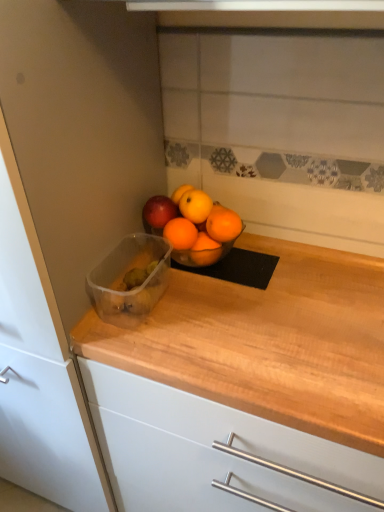
Describe the element at coordinates (195, 206) in the screenshot. The width and height of the screenshot is (384, 512). I see `orange matte/orange at center` at that location.

Locate an element on the screen. This screenshot has width=384, height=512. wooden countertop at left is located at coordinates (73, 201).

At what (x,y) coordinates should I click in order to perform the action: click on transparent plastic container at center. Please return your answer as a coordinate pair (x, y). Looking at the image, I should click on (123, 279).

What are the coordinates of `glass bowl lying in front of the orange matte/orange at center` in the screenshot? It's located at 123,279.

Is transparent plastic container at center facing towards orange matte/orange at center?

No, transparent plastic container at center is not turned towards orange matte/orange at center.

From the image's perspective, is transparent plastic container at center located above orange matte/orange at center?

Incorrect, from the image's perspective, transparent plastic container at center is lower than orange matte/orange at center.

Between transparent plastic container at center and orange matte/orange at center, which one has larger width?

Wider between the two is transparent plastic container at center.

From a real-world perspective, who is located higher, wooden countertop at left or transparent plastic container at center?

transparent plastic container at center, from a real-world perspective.

This screenshot has height=512, width=384. What are the coordinates of `glass bowl above the wooden countertop at left (from the image's perspective)` in the screenshot? It's located at pos(123,279).

Considering the points (118, 95) and (139, 257), which point is in front, point (118, 95) or point (139, 257)?

The point (118, 95) is in front.

Do you think wooden countertop at left is within transparent plastic container at center, or outside of it?

The correct answer is: outside.

Choose the correct answer: Is transparent plastic container at center inside wooden countertop at left or outside it?

transparent plastic container at center is not enclosed by wooden countertop at left.

Based on their positions, is transparent plastic container at center located to the left or right of wooden countertop at left?

Clearly, transparent plastic container at center is on the right of wooden countertop at left in the image.

Considering the positions of objects transparent plastic container at center and wooden countertop at left in the image provided, who is behind, transparent plastic container at center or wooden countertop at left?

transparent plastic container at center is further from the camera.

Is point (161, 252) positioned behind point (107, 117)?

Yes, point (161, 252) is behind point (107, 117).

Looking at the image, does orange matte/orange at center seem bigger or smaller compared to wooden at center?

orange matte/orange at center is smaller than wooden at center.

Identify the location of countertop that is on the right side of orange matte/orange at center. The image size is (384, 512). (245, 387).

Can you confirm if orange matte/orange at center is wider than wooden at center?

Incorrect, the width of orange matte/orange at center does not surpass that of wooden at center.

Does point (202, 203) appear closer or farther from the camera than point (254, 434)?

Clearly, point (202, 203) is more distant from the camera than point (254, 434).

Is wooden countertop at left facing towards orange matte/orange at center?

No, wooden countertop at left is not oriented towards orange matte/orange at center.

From a real-world perspective, who is located higher, wooden countertop at left or orange matte/orange at center?

orange matte/orange at center.

Based on their sizes in the image, would you say wooden countertop at left is bigger or smaller than orange matte/orange at center?

wooden countertop at left is bigger than orange matte/orange at center.

Which is in front, point (128, 146) or point (201, 208)?

Positioned in front is point (128, 146).

Does transparent plastic container at center have a smaller size compared to wooden at center?

Correct, transparent plastic container at center occupies less space than wooden at center.

Based on the photo, between transparent plastic container at center and wooden at center, which one is positioned behind?

transparent plastic container at center is behind.

At what (x,y) coordinates should I click in order to perform the action: click on glass bowl on the left of wooden at center. Please return your answer as a coordinate pair (x, y). Image resolution: width=384 pixels, height=512 pixels. Looking at the image, I should click on (123, 279).

Based on the photo, considering the relative sizes of transparent plastic container at center and wooden at center in the image provided, is transparent plastic container at center thinner than wooden at center?

Yes, transparent plastic container at center is thinner than wooden at center.

Based on the photo, considering the sizes of objects wooden at center and wooden countertop at left in the image provided, who is wider, wooden at center or wooden countertop at left?

With larger width is wooden countertop at left.

From a real-world perspective, is wooden at center positioned above or below wooden countertop at left?

wooden at center is below wooden countertop at left.

From the picture: Which is closer, (184, 497) or (115, 65)?

Point (184, 497).

From the picture: How different are the orientations of wooden at center and wooden countertop at left in degrees?

They differ by 0.104 degrees in their facing directions.

This screenshot has height=512, width=384. In order to click on orange behind the transparent plastic container at center in this screenshot , I will do `click(195, 206)`.

Find the location of a particular element. This screenshot has height=512, width=384. glass bowl above the wooden countertop at left (from a real-world perspective) is located at coordinates (123, 279).

Estimate the real-world distances between objects in this image. Which object is further from orange matte/orange at center, wooden countertop at left or wooden at center?

wooden at center is positioned further to the anchor orange matte/orange at center.

Considering their positions, is transparent plastic container at center positioned further to wooden countertop at left than wooden at center?

The object further to wooden countertop at left is wooden at center.

Looking at the image, which one is located closer to transparent plastic container at center, wooden at center or orange matte/orange at center?

Among the two, orange matte/orange at center is located nearer to transparent plastic container at center.

Consider the image. Looking at the image, which one is located closer to transparent plastic container at center, wooden at center or wooden countertop at left?

wooden countertop at left lies closer to transparent plastic container at center than the other object.

Based on their spatial positions, is wooden at center or orange matte/orange at center closer to wooden countertop at left?

Based on the image, wooden at center appears to be nearer to wooden countertop at left.

Based on their spatial positions, is wooden countertop at left or wooden at center further from transparent plastic container at center?

wooden at center.

When comparing their distances from wooden countertop at left, does wooden at center or transparent plastic container at center seem further?

wooden at center is further to wooden countertop at left.

Estimate the real-world distances between objects in this image. Which object is further from wooden countertop at left, orange matte/orange at center or wooden at center?

Among the two, orange matte/orange at center is located further to wooden countertop at left.

At what (x,y) coordinates should I click in order to perform the action: click on glass bowl that lies between orange matte/orange at center and wooden at center from top to bottom. Please return your answer as a coordinate pair (x, y). This screenshot has width=384, height=512. Looking at the image, I should click on (x=123, y=279).

In order to click on glass bowl located between wooden countertop at left and orange matte/orange at center in the depth direction in this screenshot , I will do `click(123, 279)`.

This screenshot has height=512, width=384. Find the location of `glass bowl between wooden countertop at left and wooden at center`. glass bowl between wooden countertop at left and wooden at center is located at coordinates (123, 279).

Identify the location of orange situated between wooden countertop at left and wooden at center from left to right. (195, 206).